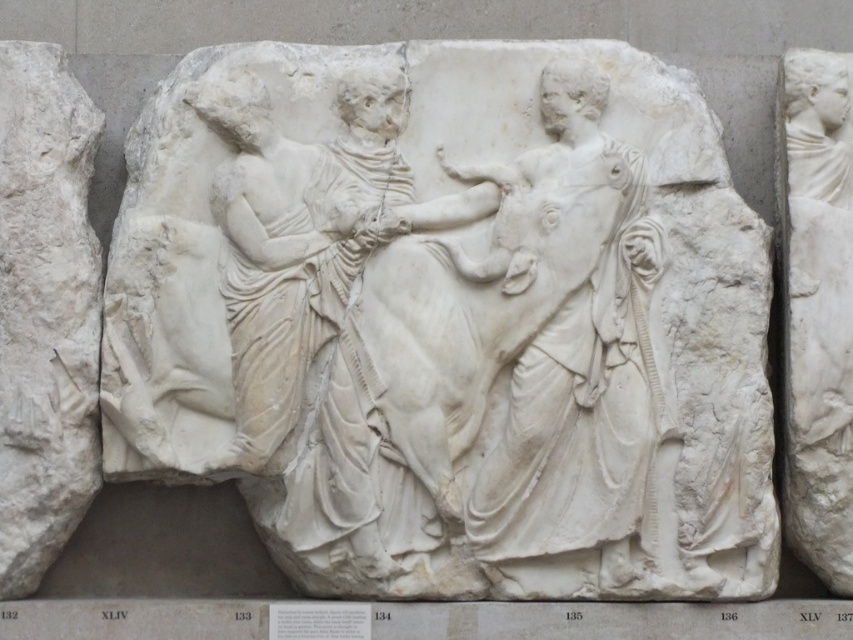
Between point (509, 412) and point (838, 294), which one is positioned in front?

Positioned in front is point (509, 412).

Does point (573, 547) come farther from viewer compared to point (811, 157)?

No, it is not.

Between point (618, 378) and point (822, 116), which one is positioned in front?

Positioned in front is point (618, 378).

Identify the location of white marble figure at center. (577, 368).

Can you confirm if white marble relief at center is thinner than white marble figure at center?

In fact, white marble relief at center might be wider than white marble figure at center.

Between point (666, 227) and point (486, 515), which one is positioned in front?

Point (486, 515) is in front.

Is point (138, 147) closer to camera compared to point (659, 396)?

No, it is not.

Locate an element on the screen. white marble relief at center is located at coordinates (450, 317).

Who is higher up, white marble relief at center or white marble statue at right?

Positioned higher is white marble relief at center.

Is point (514, 228) positioned before point (828, 515)?

Yes, point (514, 228) is closer to viewer.

The height and width of the screenshot is (640, 853). What are the coordinates of `white marble relief at center` in the screenshot? It's located at (450, 317).